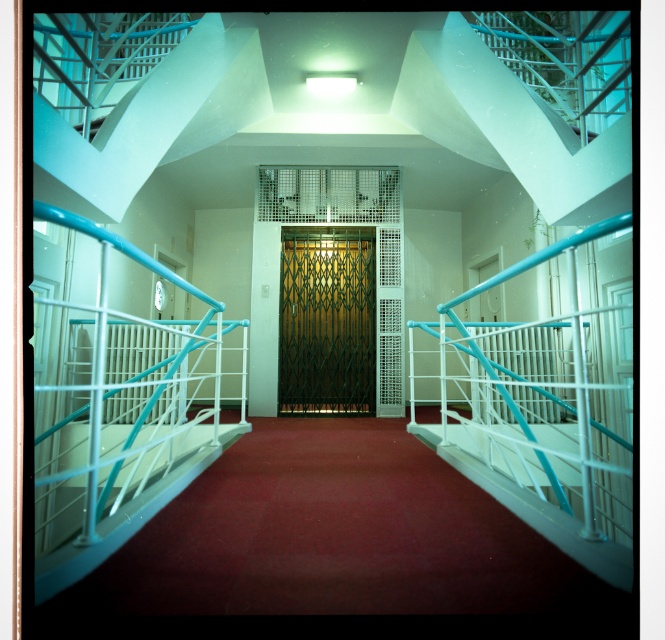
You are a delivery person carrying a large package that requires a clear path of at least 20 inches between the metallic gold elevator at center and the green textured door at center. Can you safely navigate through the space between them?

The metallic gold elevator at center and the green textured door at center are 17.88 inches apart from each other, which is less than the required 20 inches. Therefore, you cannot safely navigate through the space between them with the large package.

You are standing in the corridor and want to enter the elevator. Which direction should you move relative to the green textured door at center to reach the metallic gold elevator at center?

To reach the metallic gold elevator at center from the green textured door at center, you should move to the left since the metallic gold elevator at center is positioned to the left of the green textured door at center.

You are standing in the corridor looking at the elevator. There are two points marked in the scene, point 1 at coordinates point (356, 182) and point 2 at coordinates point (317, 321). Which point is closer to you?

Point (356, 182) is closer to the camera than point (317, 321), so point 1 is closer to you.